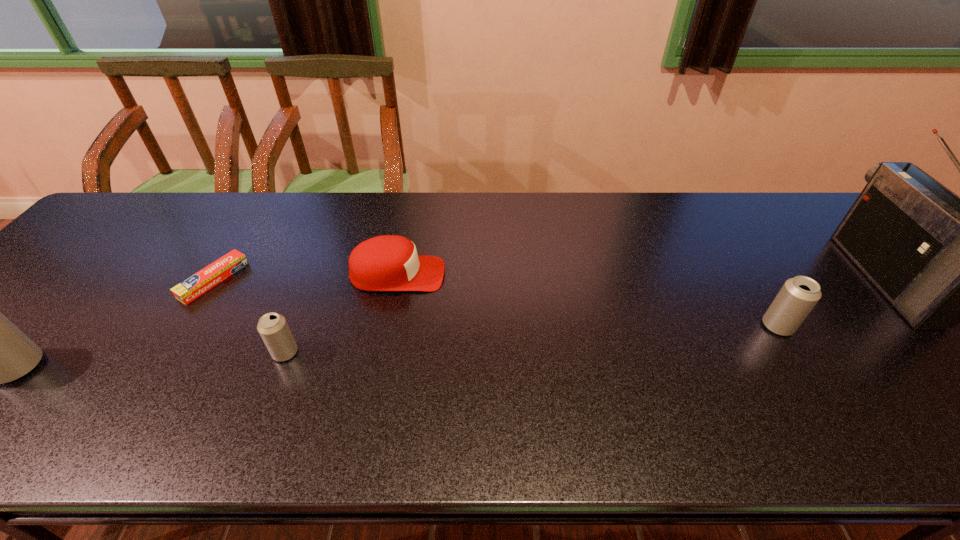
At what (x,y) coordinates should I click in order to perform the action: click on vacant region located 0.270m on the front-facing side of the fourth object from left to right. Please return your answer as a coordinate pair (x, y). This screenshot has width=960, height=540. Looking at the image, I should click on (548, 274).

Locate an element on the screen. The width and height of the screenshot is (960, 540). vacant region at the far edge is located at coordinates (649, 209).

Identify the location of free space at the near edge. (581, 390).

In the image, there is a desktop. Where is `free space at the right edge`? free space at the right edge is located at coordinates (888, 307).

Image resolution: width=960 pixels, height=540 pixels. I want to click on vacant region at the far right corner of the desktop, so click(830, 199).

Locate an element on the screen. vacant space that's between the shortest object and the farthest beer can is located at coordinates (495, 303).

Identify the location of vacant point located between the shortest object and the third object from right to left. (305, 278).

What are the coordinates of `free space between the toothpaste and the baseball cap` in the screenshot? It's located at (305, 278).

This screenshot has height=540, width=960. Identify the location of vacant area that lies between the second beer can from right to left and the fourth shortest object. (532, 339).

Locate an element on the screen. This screenshot has width=960, height=540. vacant point located between the shortest beer can and the farthest beer can is located at coordinates (532, 339).